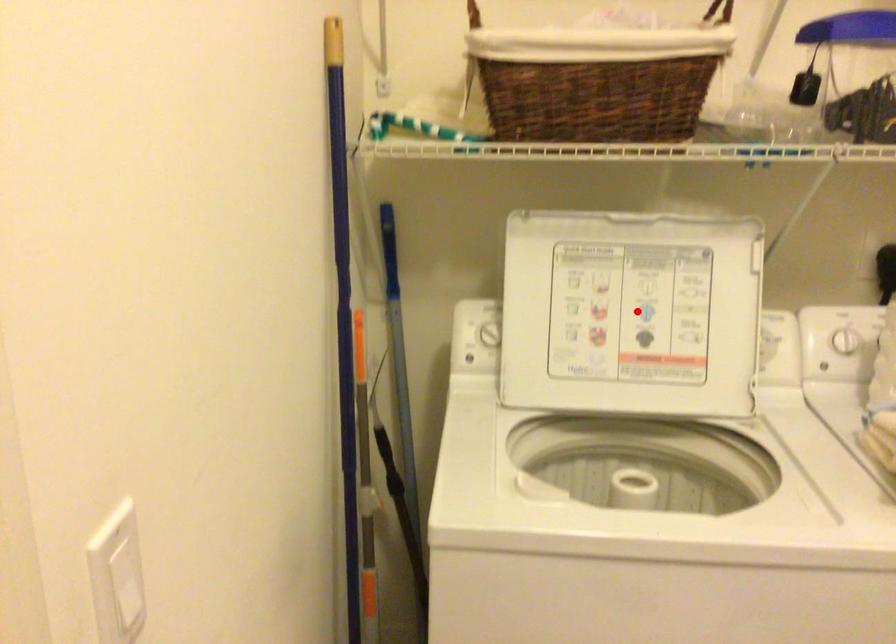
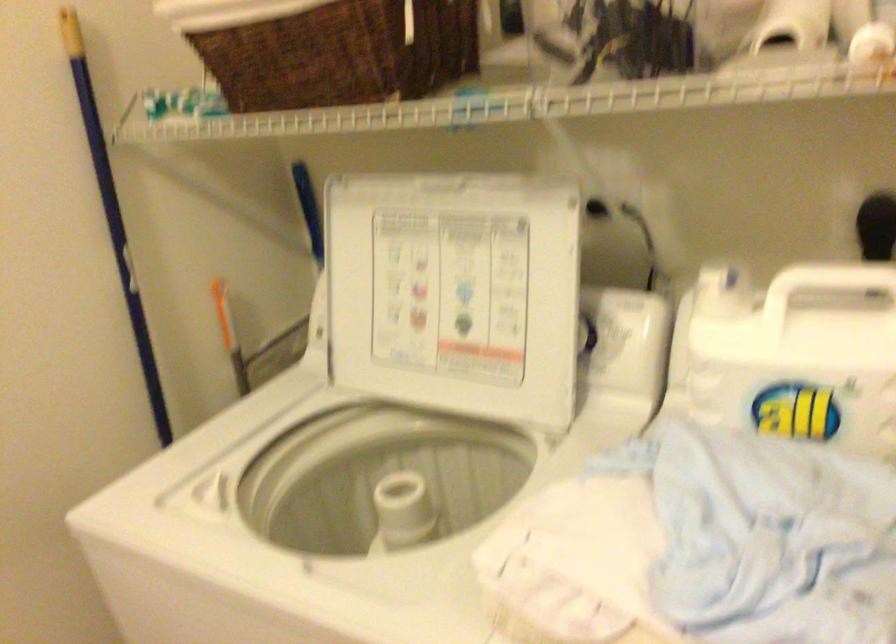
Question: I am providing you with two images of the same scene from different viewpoints. A red point is shown in image1. For the corresponding object point in image2, is it positioned nearer or farther from the camera?

Choices:
 (A) Nearer
 (B) Farther

Answer: (A)